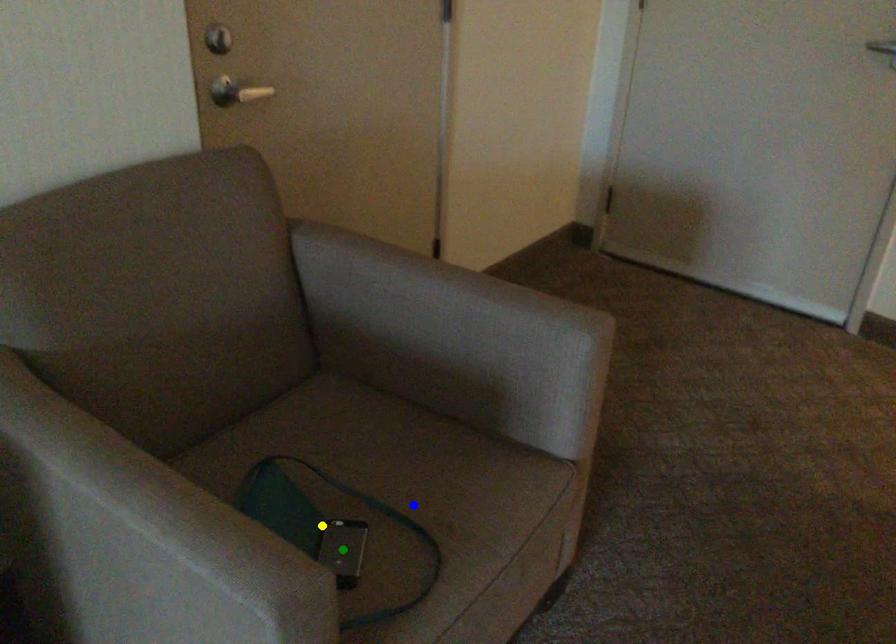
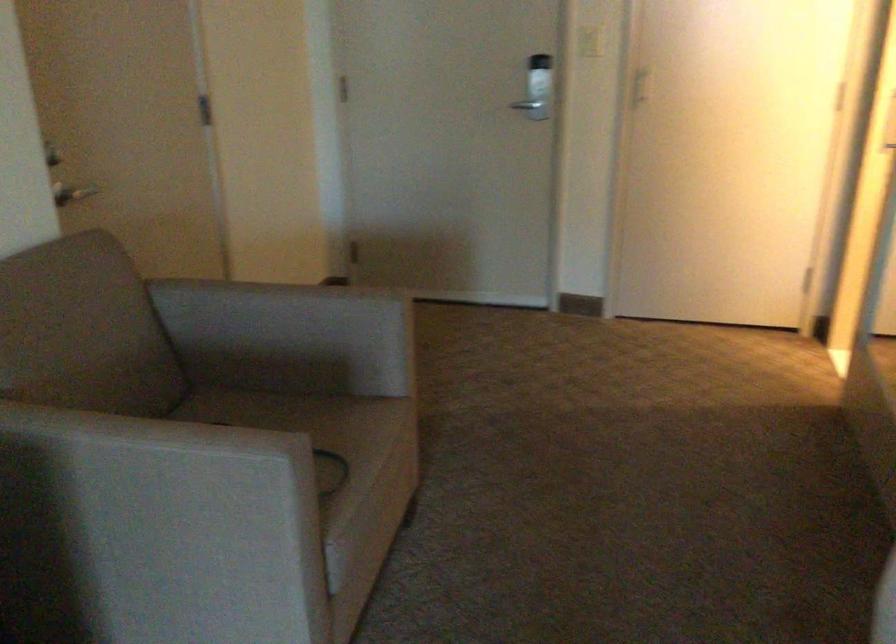
I am providing you with two images of the same scene from different viewpoints. Three points are marked in image1. Which point corresponds to a part or object that is occluded in image2?In image1, three points are marked. Which of them correspond to a part or object that is occluded in image2?Among the three points shown in image1, which one corresponds to a part or object that is no longer visible due to occlusion in image2?

green point, blue point, yellow point